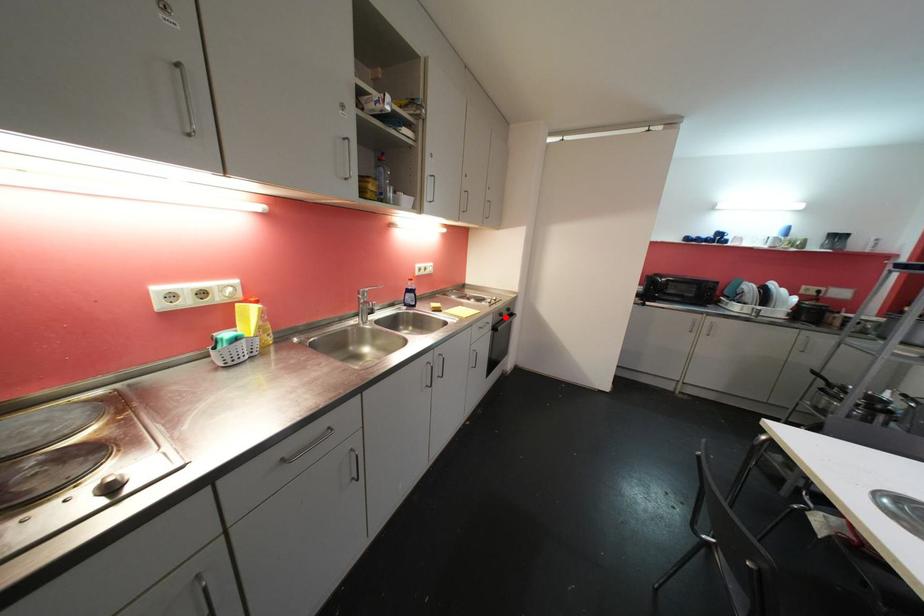
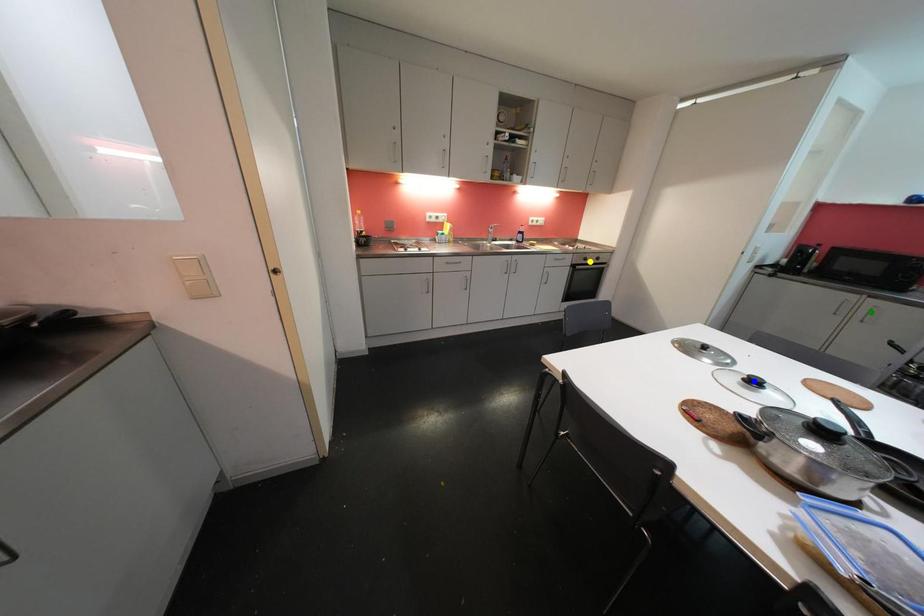
Question: I am providing you with two images of the same scene from different viewpoints. A red point is marked on the first image. You are given multiple points on the second image. Can you choose the point in image 2 that corresponds to the point in image 1?

Choices:
 (A) green point
 (B) yellow point
 (C) blue point

Answer: (B)